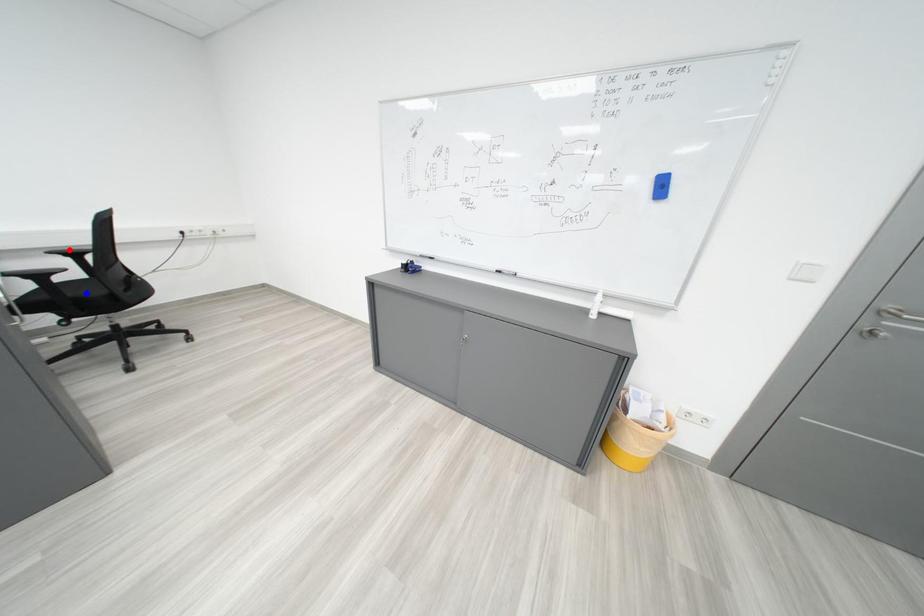
Question: In the image, two points are highlighted. Which point is nearer to the camera? Reply with the corresponding letter.

Choices:
 (A) blue point
 (B) red point

Answer: (B)